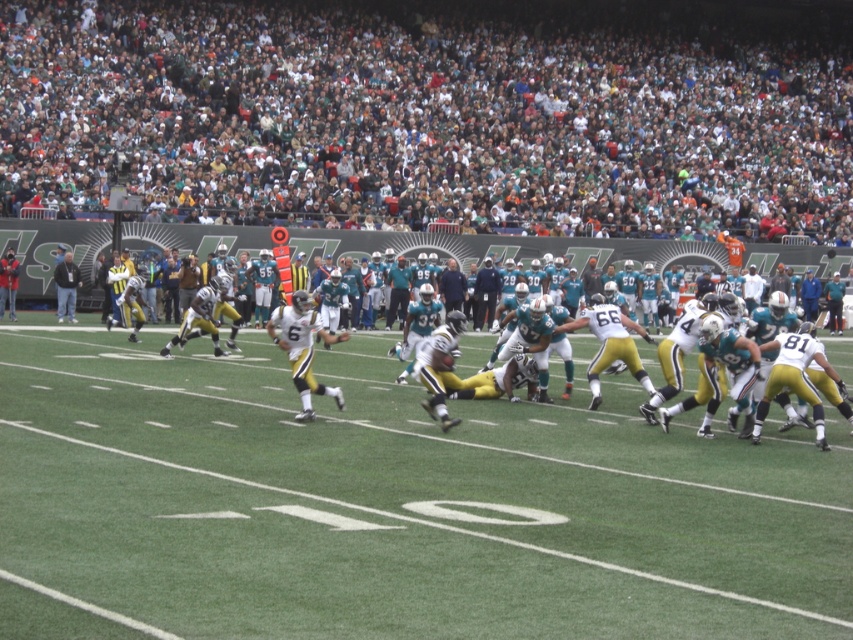
Question: Among these objects, which one is farthest from the camera?

Choices:
 (A) white fabric crowd at upper center
 (B) white jersey at center

Answer: (A)

Question: Observing the image, what is the correct spatial positioning of white fabric crowd at upper center in reference to white jersey at center?

Choices:
 (A) above
 (B) below

Answer: (A)

Question: Is white fabric crowd at upper center smaller than white jersey at center?

Choices:
 (A) no
 (B) yes

Answer: (A)

Question: Which point is farther to the camera?

Choices:
 (A) (148, 134)
 (B) (730, 310)

Answer: (A)

Question: Is the position of white fabric crowd at upper center less distant than that of white jersey at center?

Choices:
 (A) no
 (B) yes

Answer: (A)